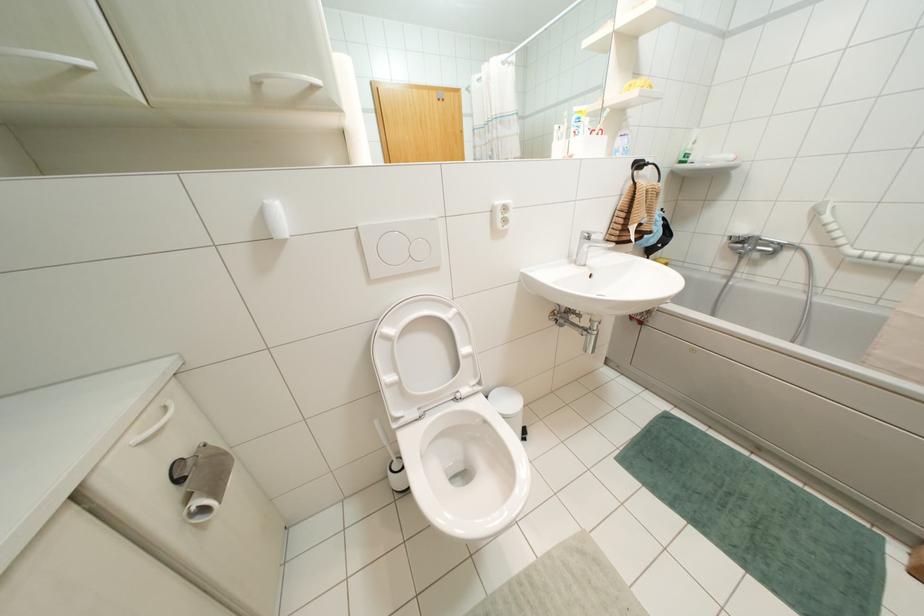
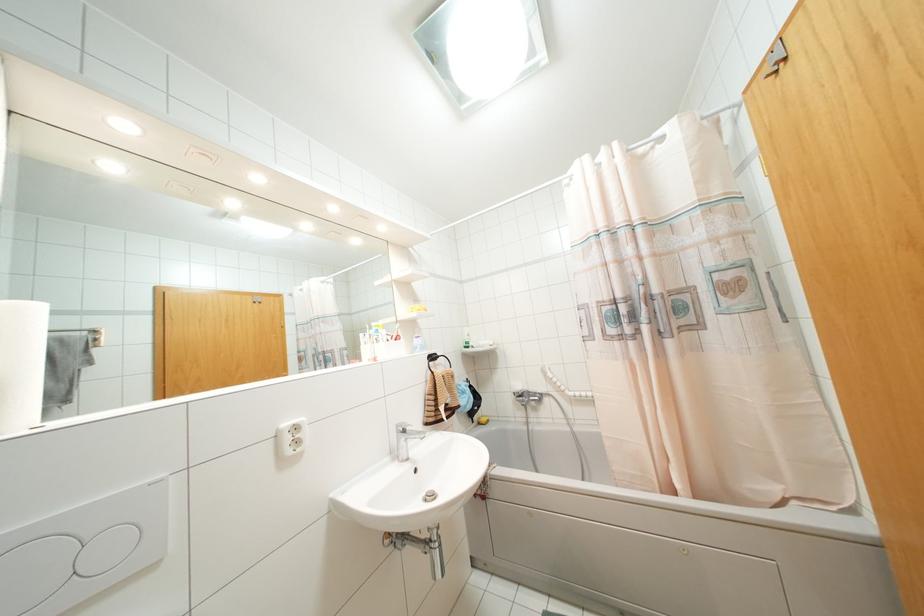
Locate, in the second image, the point that corresponds to (742,248) in the first image.

(523, 400)